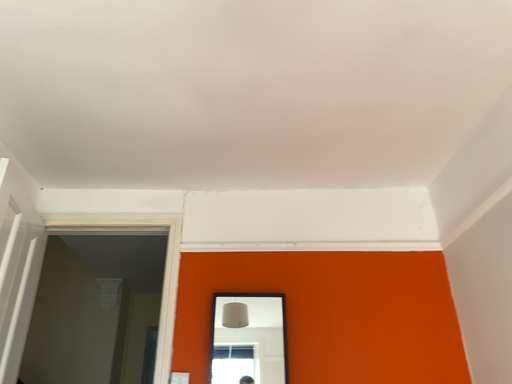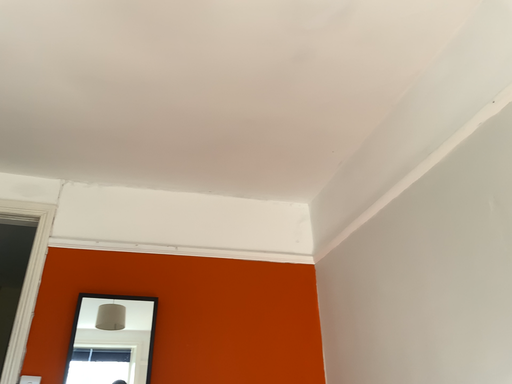
Question: Which way did the camera rotate in the video?

Choices:
 (A) rotated left
 (B) rotated right

Answer: (B)